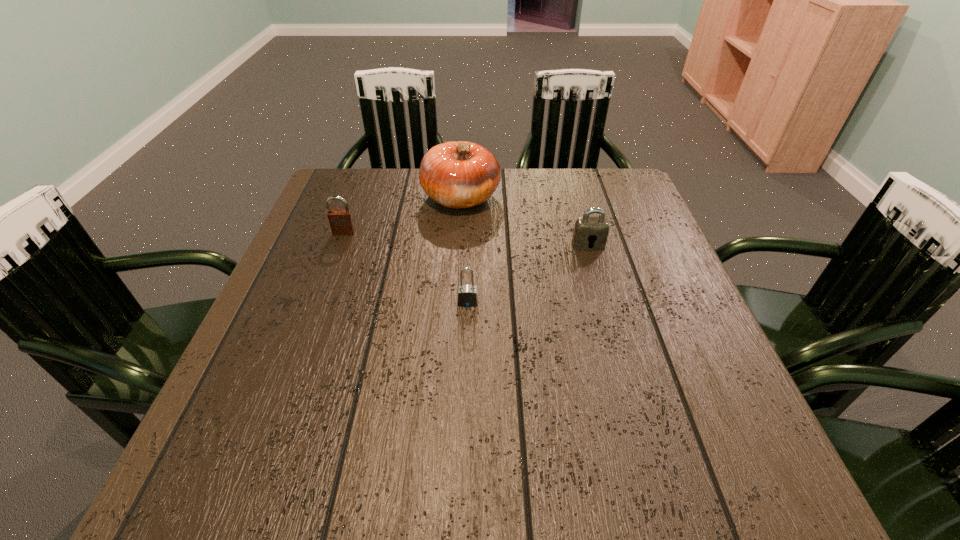
Locate an element on the screen. vacant space at the near left corner of the desktop is located at coordinates (279, 471).

I want to click on vacant position at the far right corner of the desktop, so click(x=590, y=204).

Locate an element on the screen. vacant space that is in between the pumpkin and the rightmost object is located at coordinates (524, 221).

Find the location of a particular element. This screenshot has height=540, width=960. vacant point located between the rightmost padlock and the nearest object is located at coordinates (528, 274).

This screenshot has height=540, width=960. I want to click on blank region between the pumpkin and the second farthest object, so click(402, 215).

Image resolution: width=960 pixels, height=540 pixels. I want to click on vacant area between the second nearest padlock and the tallest object, so click(x=524, y=221).

Locate an element on the screen. The height and width of the screenshot is (540, 960). free spot between the tallest object and the rightmost object is located at coordinates (524, 221).

Locate an element on the screen. The image size is (960, 540). free space between the rightmost object and the tallest object is located at coordinates (524, 221).

Image resolution: width=960 pixels, height=540 pixels. I want to click on blank region between the farthest padlock and the second farthest padlock, so click(x=467, y=239).

Locate an element on the screen. Image resolution: width=960 pixels, height=540 pixels. vacant space that's between the leftmost padlock and the rightmost padlock is located at coordinates (467, 239).